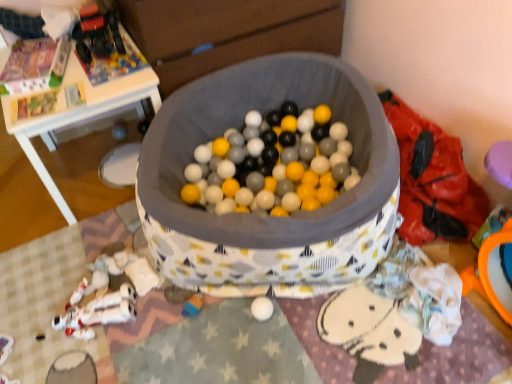
Find the location of a particular element. Image resolution: width=512 pixels, height=384 pixels. vacant area that is situated to the right of white plastic toy at lower left, the 2th toy ordered from the bottom is located at coordinates (161, 317).